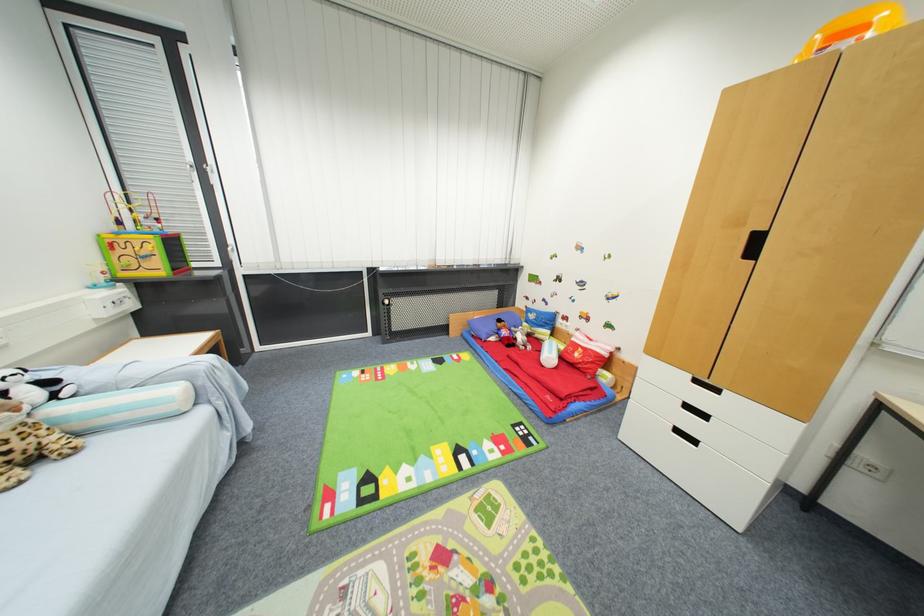
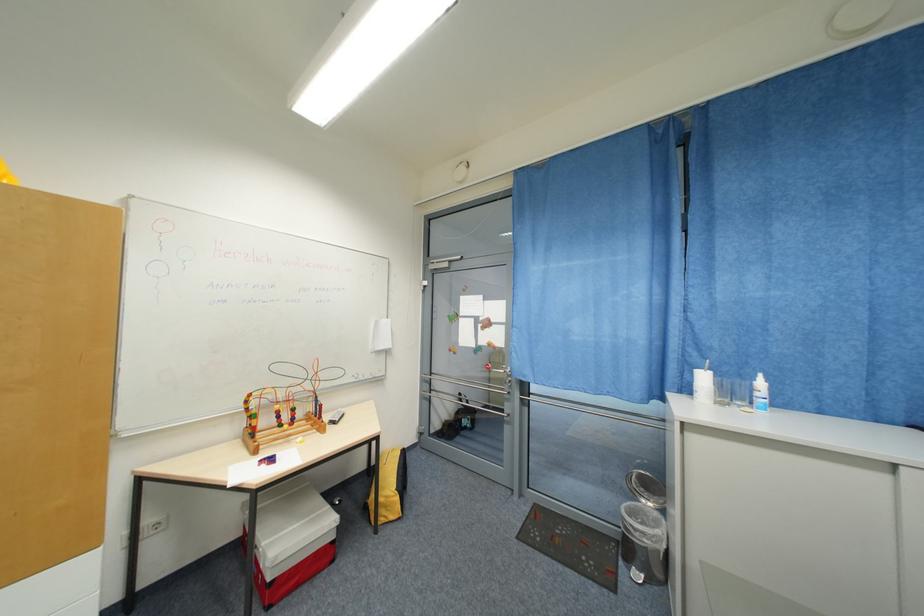
Question: How did the camera likely rotate?

Choices:
 (A) Left
 (B) Right
 (C) Up
 (D) Down

Answer: (B)